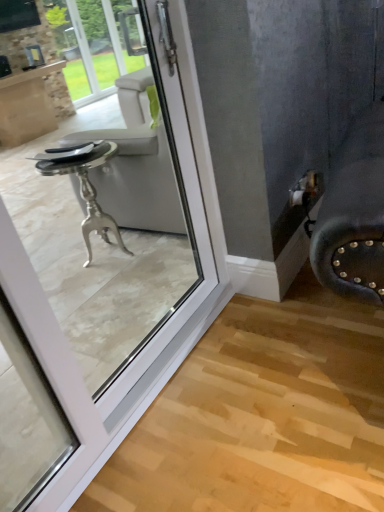
The width and height of the screenshot is (384, 512). What do you see at coordinates (88, 192) in the screenshot? I see `silver metallic table at left` at bounding box center [88, 192].

Locate an element on the screen. The image size is (384, 512). silver metallic table at left is located at coordinates (88, 192).

Locate an element on the screen. This screenshot has height=512, width=384. silver metallic table at left is located at coordinates (88, 192).